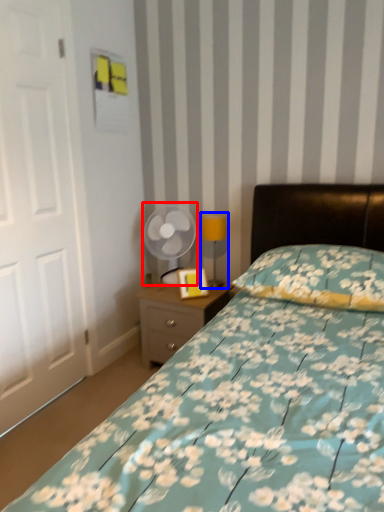
Question: Which object appears closest to the camera in this image, mechanical fan (highlighted by a red box) or table lamp (highlighted by a blue box)?

Choices:
 (A) mechanical fan
 (B) table lamp

Answer: (B)